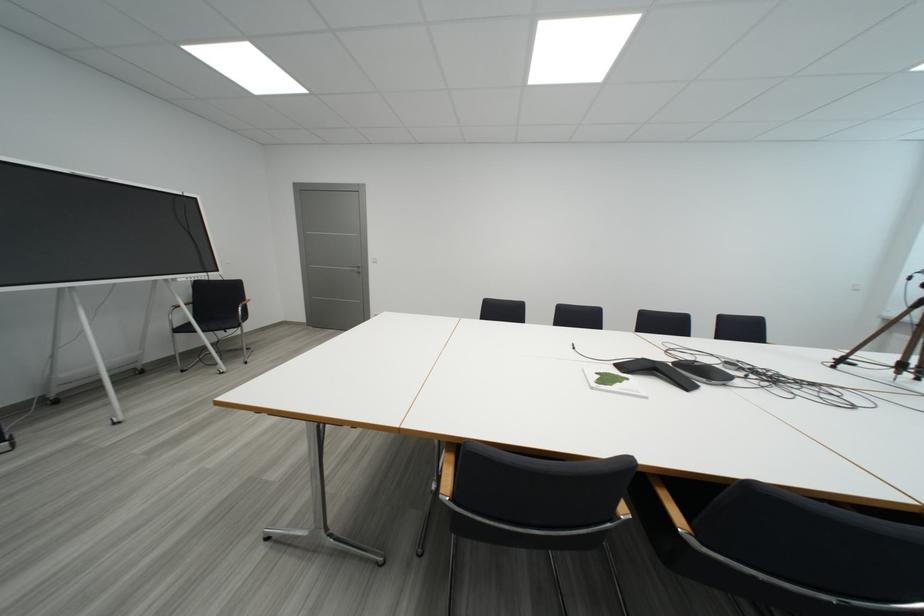
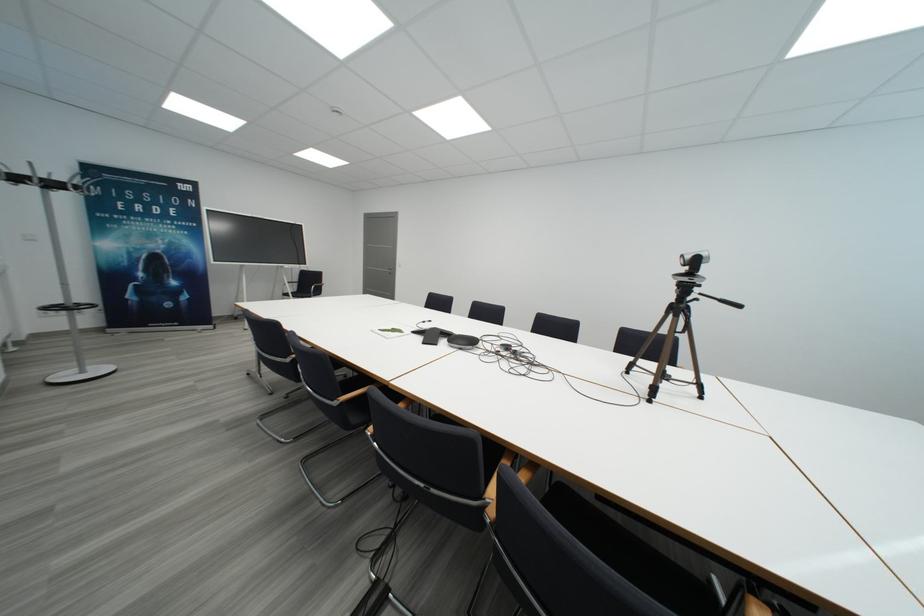
The point at (651, 363) is marked in the first image. Where is the corresponding point in the second image?

(442, 331)